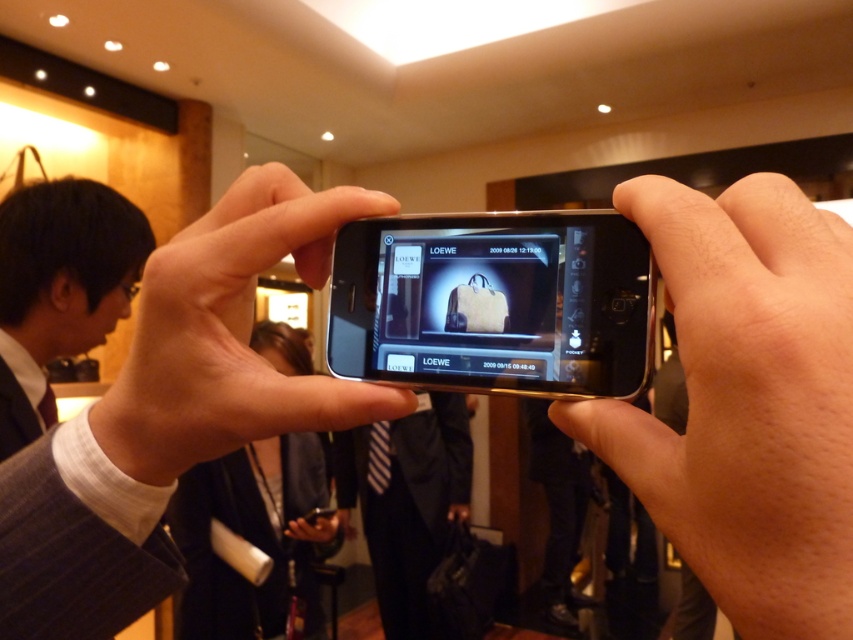
Locate an element on the screen. The height and width of the screenshot is (640, 853). satin black smartphone at center is located at coordinates (494, 304).

Is satin black smartphone at center positioned behind black fabric suit at center?

No, it is not.

I want to click on satin black smartphone at center, so click(x=494, y=304).

Can you confirm if satin gold phone at center is shorter than black suit at left?

Yes, satin gold phone at center is shorter than black suit at left.

The height and width of the screenshot is (640, 853). Identify the location of satin gold phone at center. (230, 333).

Image resolution: width=853 pixels, height=640 pixels. What do you see at coordinates (230, 333) in the screenshot?
I see `satin gold phone at center` at bounding box center [230, 333].

Identify the location of satin gold phone at center. This screenshot has width=853, height=640. (230, 333).

Who is higher up, satin black smartphone at center or satin gold phone at center?

Positioned higher is satin black smartphone at center.

Is satin black smartphone at center thinner than satin gold phone at center?

Yes, satin black smartphone at center is thinner than satin gold phone at center.

Locate an element on the screen. satin black smartphone at center is located at coordinates (494, 304).

Where is `satin black smartphone at center`? Image resolution: width=853 pixels, height=640 pixels. satin black smartphone at center is located at coordinates (494, 304).